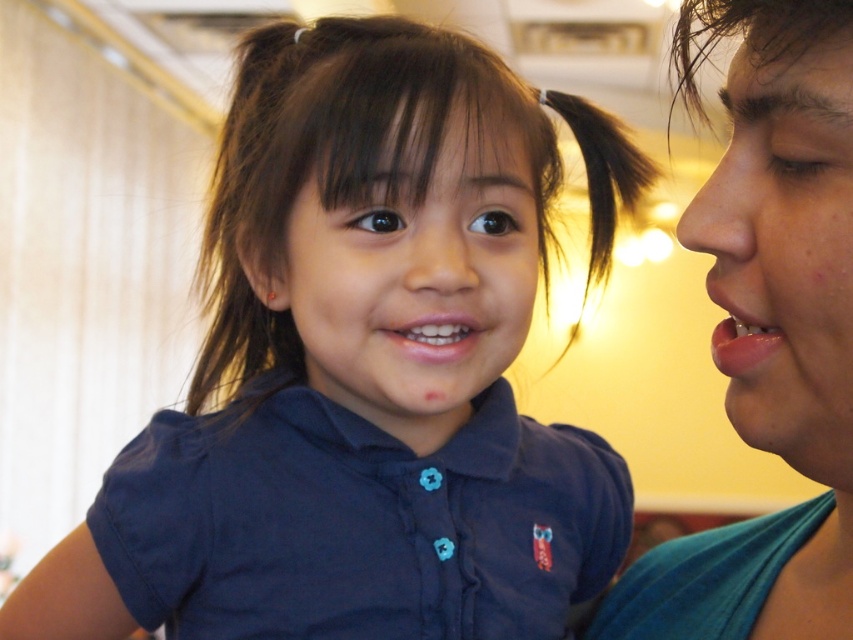
Question: Which of the following is the closest to the observer?

Choices:
 (A) (180, 490)
 (B) (784, 154)
 (C) (788, 4)

Answer: (C)

Question: Which of the following is the closest to the observer?

Choices:
 (A) pink glossy lips at right
 (B) smooth skin face at center
 (C) dark brown silky hair at upper right

Answer: (C)

Question: Does navy blue cotton shirt at center appear over smooth skin face at center?

Choices:
 (A) no
 (B) yes

Answer: (A)

Question: Observing the image, what is the correct spatial positioning of black silky hair at upper center in reference to dark brown silky hair at upper right?

Choices:
 (A) above
 (B) below

Answer: (B)

Question: Does navy blue cotton shirt at center have a greater width compared to pink glossy lips at right?

Choices:
 (A) no
 (B) yes

Answer: (B)

Question: Which is nearer to the smooth skin face at center?

Choices:
 (A) black silky hair at upper center
 (B) matte teal shirt at right

Answer: (A)